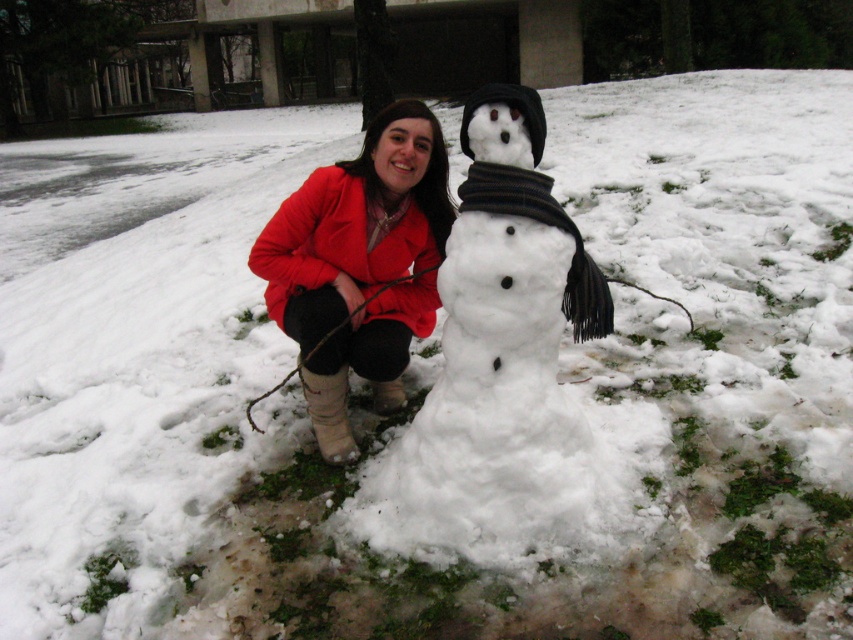
You are standing at the point marked as point (500, 368). What object is located exactly at that point?

The white fluffy snowman at center is located exactly at point (500, 368).

You are a photographer trying to capture a photo of the white fluffy snowman at center and the matte red coat at center. Since you want the snowman to look bigger in the photo than the person, which object should you zoom in on more?

The white fluffy snowman at center is larger in size than the matte red coat at center, so you should zoom in more on the white fluffy snowman at center to emphasize its size difference compared to the matte red coat at center.